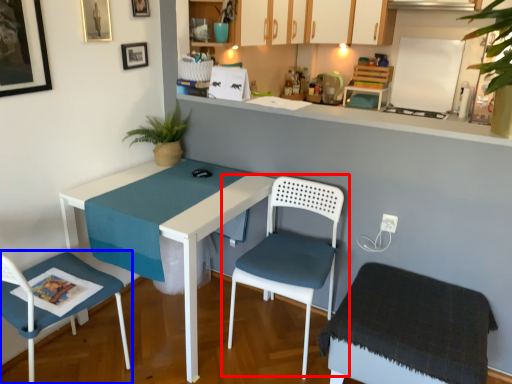
Question: Which of the following is the closest to the observer, chair (highlighted by a red box) or chair (highlighted by a blue box)?

Choices:
 (A) chair
 (B) chair

Answer: (B)